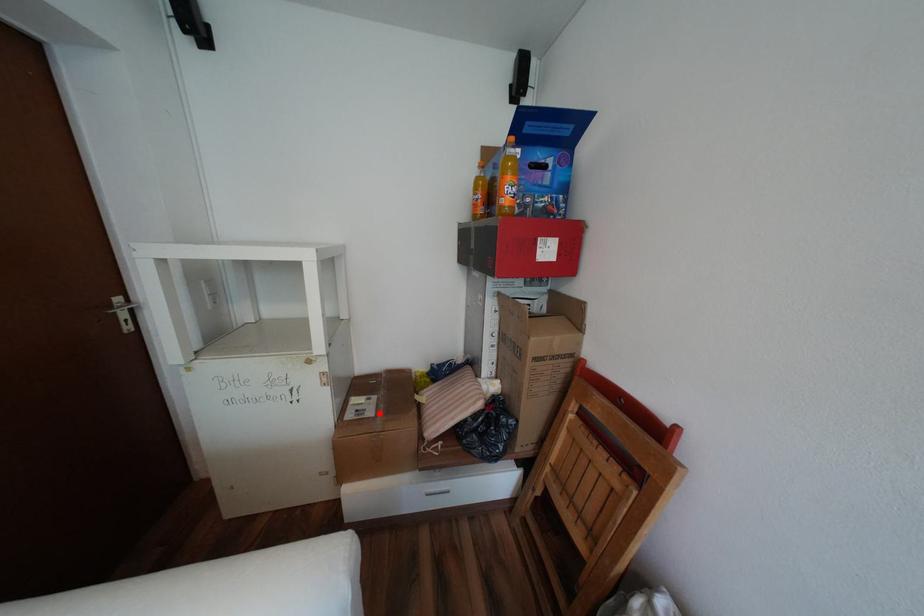
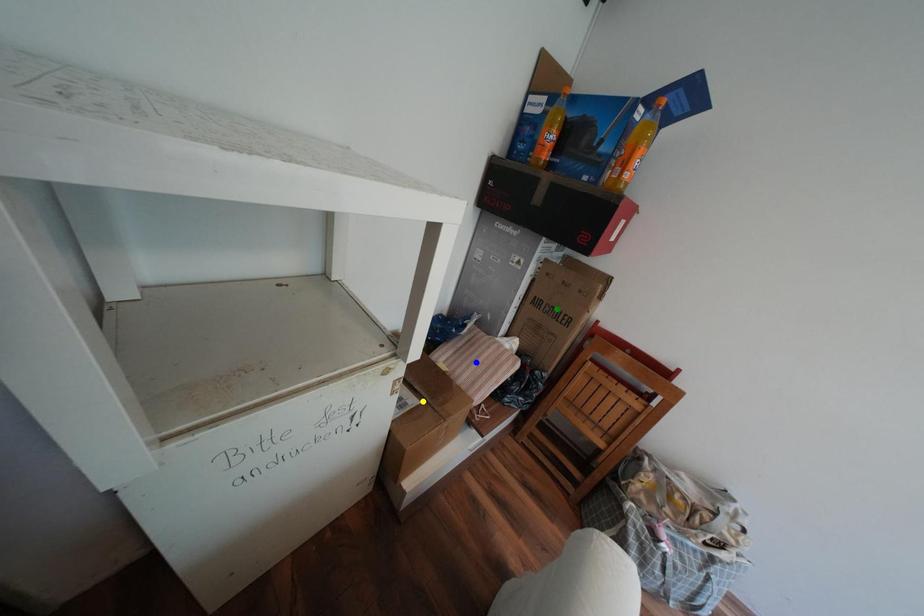
Question: I am providing you with two images of the same scene from different viewpoints. A red point is marked on the first image. You are given multiple points on the second image. Which point in image 2 represents the same 3d spot as the red point in image 1?

Choices:
 (A) blue point
 (B) yellow point
 (C) green point

Answer: (B)